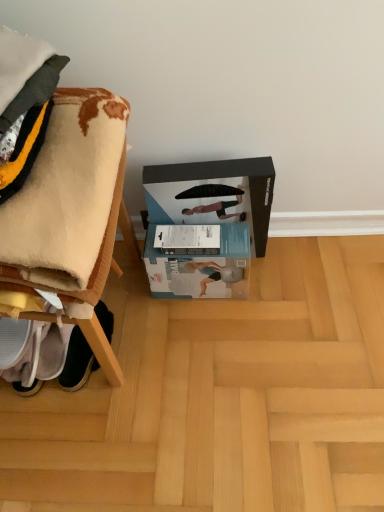
Where is `free space in front of white fabric shoe at lower left`? free space in front of white fabric shoe at lower left is located at coordinates (83, 417).